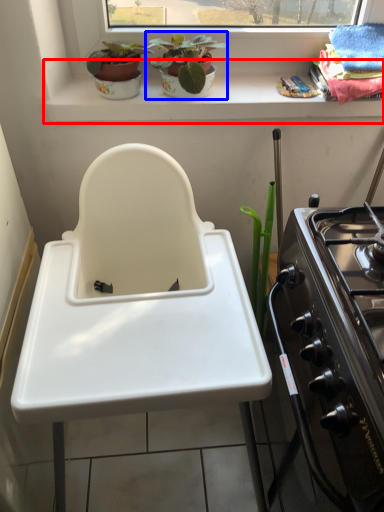
Question: Which object is further to the camera taking this photo, window sill (highlighted by a red box) or houseplant (highlighted by a blue box)?

Choices:
 (A) window sill
 (B) houseplant

Answer: (A)